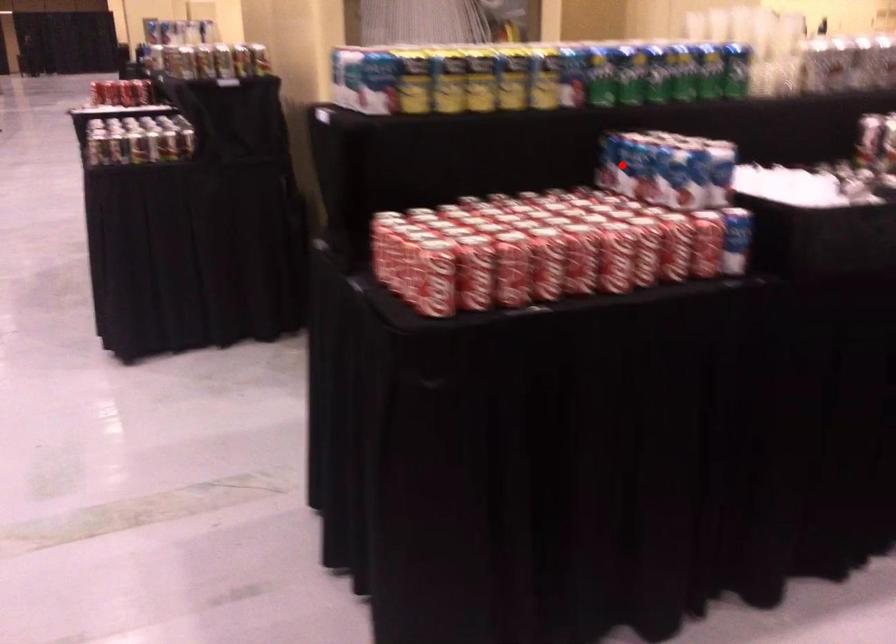
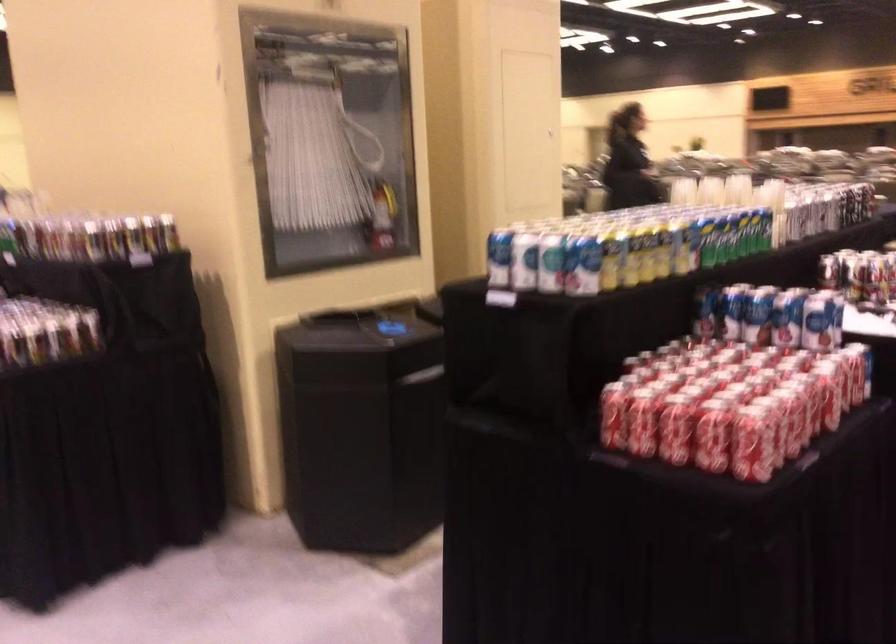
Locate, in the second image, the point that corresponds to the highlighted location in the first image.

(757, 315)